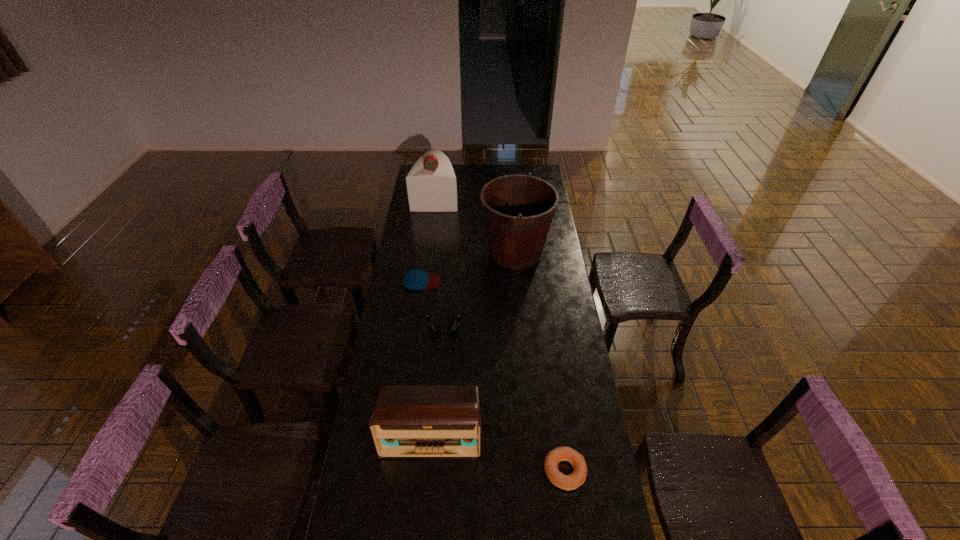
In the image, there is a desktop. Where is `free region at the far edge`? This screenshot has width=960, height=540. free region at the far edge is located at coordinates (457, 168).

Identify the location of free space at the left edge. pos(400,252).

This screenshot has width=960, height=540. Identify the location of free location at the right edge of the desktop. (556, 221).

In the image, there is a desktop. Identify the location of free space at the far right corner. coord(535,173).

The height and width of the screenshot is (540, 960). Identify the location of free space between the cake and the bucket. (475, 224).

Locate an element on the screen. blank region between the bucket and the baseball cap is located at coordinates (468, 267).

The height and width of the screenshot is (540, 960). Identify the location of free spot between the bagel and the farthest object. (500, 334).

Locate an element on the screen. The width and height of the screenshot is (960, 540). empty space that is in between the bucket and the farthest object is located at coordinates (475, 224).

At what (x,y) coordinates should I click in order to perform the action: click on vacant space that's between the farthest object and the bagel. Please return your answer as a coordinate pair (x, y). Looking at the image, I should click on (500, 334).

The height and width of the screenshot is (540, 960). I want to click on free space between the third tallest object and the baseball cap, so click(x=426, y=359).